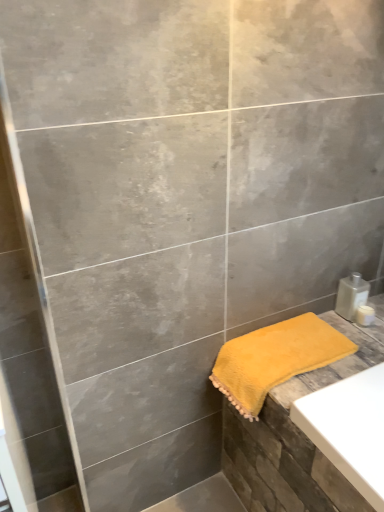
Image resolution: width=384 pixels, height=512 pixels. Describe the element at coordinates (365, 315) in the screenshot. I see `white plastic container at right` at that location.

This screenshot has height=512, width=384. Identify the location of clear plastic bottle at lower right. (351, 295).

What is the approximate width of clear plastic bottle at lower right?

clear plastic bottle at lower right is 2.88 inches in width.

Locate an element on the screen. yellow fluffy towel at lower right is located at coordinates (275, 359).

Where is `toiletry behind the clear plastic bottle at lower right`? toiletry behind the clear plastic bottle at lower right is located at coordinates (365, 315).

How far apart are white plastic container at right and clear plastic bottle at lower right?

A distance of 1.95 inches exists between white plastic container at right and clear plastic bottle at lower right.

From a real-world perspective, which is physically below, white plastic container at right or clear plastic bottle at lower right?

From a 3D spatial view, white plastic container at right is below.

Which is more to the left, white plastic container at right or clear plastic bottle at lower right?

Positioned to the left is clear plastic bottle at lower right.

From the image's perspective, is white plastic container at right over yellow fluffy towel at lower right?

Yes, from the image's perspective, white plastic container at right is above yellow fluffy towel at lower right.

Is white plastic container at right at the left side of yellow fluffy towel at lower right?

In fact, white plastic container at right is to the right of yellow fluffy towel at lower right.

From a real-world perspective, is white plastic container at right under yellow fluffy towel at lower right?

No, from a real-world perspective, white plastic container at right is not below yellow fluffy towel at lower right.

Between point (365, 324) and point (248, 352), which one is positioned behind?

The point (365, 324) is farther.

Which object is wider, clear plastic bottle at lower right or white plastic container at right?

clear plastic bottle at lower right.

Is clear plastic bottle at lower right looking in the opposite direction of white plastic container at right?

No, clear plastic bottle at lower right is not facing the opposite direction of white plastic container at right.

From the image's perspective, does clear plastic bottle at lower right appear lower than white plastic container at right?

No, from the image's perspective, clear plastic bottle at lower right is not below white plastic container at right.

Is yellow fluffy towel at lower right far away from clear plastic bottle at lower right?

No.

Measure the distance from yellow fluffy towel at lower right to clear plastic bottle at lower right.

yellow fluffy towel at lower right is 29.04 centimeters from clear plastic bottle at lower right.

From the image's perspective, which is below, yellow fluffy towel at lower right or clear plastic bottle at lower right?

From the image's view, yellow fluffy towel at lower right is below.

Does yellow fluffy towel at lower right have a lesser width compared to clear plastic bottle at lower right?

In fact, yellow fluffy towel at lower right might be wider than clear plastic bottle at lower right.

Between clear plastic bottle at lower right and yellow fluffy towel at lower right, which one has more height?

Standing taller between the two is yellow fluffy towel at lower right.

Considering their positions, is clear plastic bottle at lower right located in front of or behind yellow fluffy towel at lower right?

Clearly, clear plastic bottle at lower right is behind yellow fluffy towel at lower right.

Is yellow fluffy towel at lower right located within clear plastic bottle at lower right?

Definitely not — yellow fluffy towel at lower right is not inside clear plastic bottle at lower right.

Is white plastic container at right inside yellow fluffy towel at lower right?

No, yellow fluffy towel at lower right does not contain white plastic container at right.

How many degrees apart are the facing directions of yellow fluffy towel at lower right and white plastic container at right?

yellow fluffy towel at lower right and white plastic container at right are facing 0.237 degrees away from each other.

From their relative heights in the image, would you say yellow fluffy towel at lower right is taller or shorter than white plastic container at right?

In the image, yellow fluffy towel at lower right appears to be taller than white plastic container at right.

The image size is (384, 512). In order to click on toiletry that is on the right side of yellow fluffy towel at lower right in this screenshot , I will do `click(365, 315)`.

Where is `toiletry that appears behind the clear plastic bottle at lower right`? The width and height of the screenshot is (384, 512). toiletry that appears behind the clear plastic bottle at lower right is located at coordinates (365, 315).

Image resolution: width=384 pixels, height=512 pixels. Find the location of `toiletry lying above the yellow fluffy towel at lower right (from the image's perspective)`. toiletry lying above the yellow fluffy towel at lower right (from the image's perspective) is located at coordinates (365, 315).

Consider the image. Estimate the real-world distances between objects in this image. Which object is closer to clear plastic bottle at lower right, white plastic container at right or yellow fluffy towel at lower right?

white plastic container at right lies closer to clear plastic bottle at lower right than the other object.

Considering their positions, is clear plastic bottle at lower right positioned closer to white plastic container at right than yellow fluffy towel at lower right?

clear plastic bottle at lower right lies closer to white plastic container at right than the other object.

Considering their positions, is clear plastic bottle at lower right positioned closer to yellow fluffy towel at lower right than white plastic container at right?

Based on the image, clear plastic bottle at lower right appears to be nearer to yellow fluffy towel at lower right.

Estimate the real-world distances between objects in this image. Which object is further from white plastic container at right, yellow fluffy towel at lower right or clear plastic bottle at lower right?

yellow fluffy towel at lower right.

Estimate the real-world distances between objects in this image. Which object is further from yellow fluffy towel at lower right, white plastic container at right or clear plastic bottle at lower right?

Based on the image, white plastic container at right appears to be further to yellow fluffy towel at lower right.

When comparing their distances from clear plastic bottle at lower right, does yellow fluffy towel at lower right or white plastic container at right seem closer?

white plastic container at right is closer to clear plastic bottle at lower right.

Image resolution: width=384 pixels, height=512 pixels. What are the coordinates of `soap dispenser situated between yellow fluffy towel at lower right and white plastic container at right from left to right` in the screenshot? It's located at (351, 295).